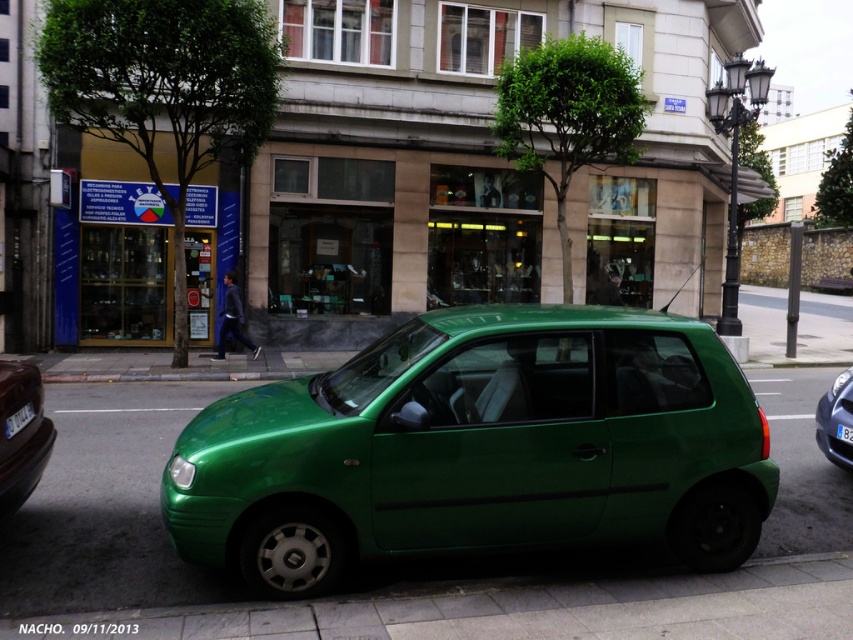
Which is behind, point (277, 388) or point (26, 406)?

The point (277, 388) is behind.

Is green matte car at center positioned behind white plastic license plate at lower left?

No, green matte car at center is in front of white plastic license plate at lower left.

Is point (483, 390) closer to camera compared to point (18, 419)?

Yes, point (483, 390) is closer to viewer.

You are a GUI agent. You are given a task and a screenshot of the screen. Output one action in this format:
    pyautogui.click(x=<x>, y=<y>)
    Task: Click on the green matte car at center
    The image size is (853, 640).
    Given the screenshot: What is the action you would take?
    pyautogui.click(x=479, y=449)

Is green matte hatchback at lower left to the left of white plastic license plate at lower left from the viewer's perspective?

Yes, green matte hatchback at lower left is to the left of white plastic license plate at lower left.

Which is behind, point (48, 438) or point (33, 410)?

Positioned behind is point (48, 438).

Between point (7, 493) and point (15, 419), which one is positioned behind?

Point (15, 419)

You are a GUI agent. You are given a task and a screenshot of the screen. Output one action in this format:
    pyautogui.click(x=<x>, y=<y>)
    Task: Click on the green matte hatchback at lower left
    This screenshot has width=853, height=640.
    Given the screenshot: What is the action you would take?
    pyautogui.click(x=21, y=433)

What do you see at coordinates (21, 433) in the screenshot?
I see `green matte hatchback at lower left` at bounding box center [21, 433].

Is the position of green matte hatchback at lower left more distant than that of green matte hatchback at right?

No, green matte hatchback at lower left is closer to the viewer.

Find the location of a particular element. This screenshot has width=853, height=640. green matte hatchback at lower left is located at coordinates (21, 433).